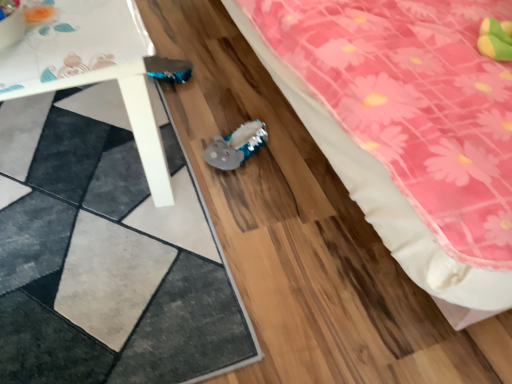
Locate an element on the screen. This screenshot has width=512, height=384. vacant space underneath fuzzy fabric plushie at center (from a real-world perspective) is located at coordinates (232, 160).